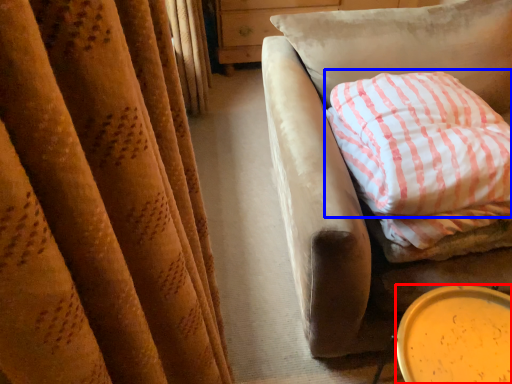
Question: Which object is further to the camera taking this photo, beverage (highlighted by a red box) or pillow (highlighted by a blue box)?

Choices:
 (A) beverage
 (B) pillow

Answer: (B)